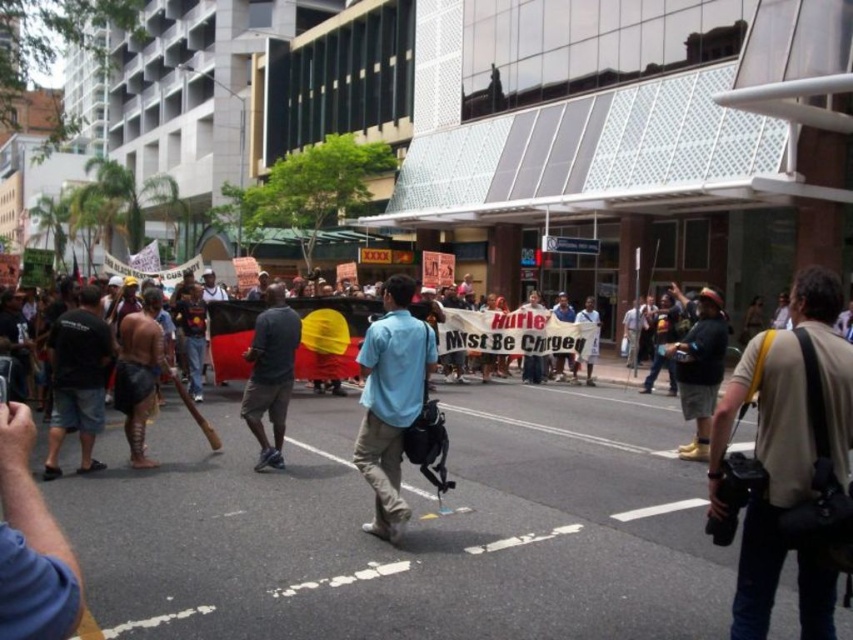
Question: Can you confirm if black cotton shirt at left is wider than white paper banner at center?

Choices:
 (A) yes
 (B) no

Answer: (B)

Question: Which of the following is the closest to the observer?

Choices:
 (A) (554, 364)
 (B) (271, 420)
 (C) (90, 294)

Answer: (C)

Question: Which point is farther from the camera taking this photo?

Choices:
 (A) (270, 324)
 (B) (376, 426)
 (C) (561, 365)

Answer: (C)

Question: Is beige fabric camera bag at center-right positioned in front of dark gray fabric at center?

Choices:
 (A) yes
 (B) no

Answer: (A)

Question: Which point is farther to the camera?

Choices:
 (A) (276, 401)
 (B) (711, 333)
 (C) (659, 312)
 (D) (534, 358)

Answer: (C)

Question: Can you confirm if black cotton shirt at left is bigger than dark brown leather jacket at center?

Choices:
 (A) no
 (B) yes

Answer: (B)